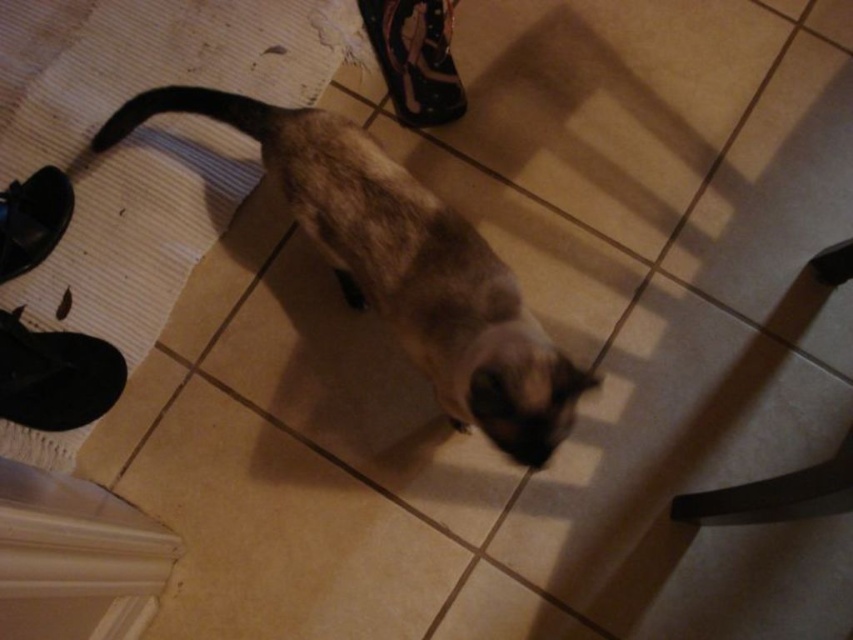
Question: Can you confirm if brown fur cat at center is positioned to the left of black suede sneaker at upper center?

Choices:
 (A) no
 (B) yes

Answer: (B)

Question: Among these objects, which one is farthest from the camera?

Choices:
 (A) brown fur cat at center
 (B) black suede sneaker at upper center

Answer: (B)

Question: Is black suede sneaker at upper center positioned in front of black rubber shoe at left?

Choices:
 (A) yes
 (B) no

Answer: (B)

Question: Which of the following is the closest to the observer?

Choices:
 (A) black suede sneaker at upper center
 (B) black rubber shoe at left

Answer: (B)

Question: Can you confirm if black suede shoe at lower left is positioned to the left of black rubber shoe at left?

Choices:
 (A) no
 (B) yes

Answer: (A)

Question: Which point is closer to the camera?

Choices:
 (A) (22, 189)
 (B) (393, 253)

Answer: (B)